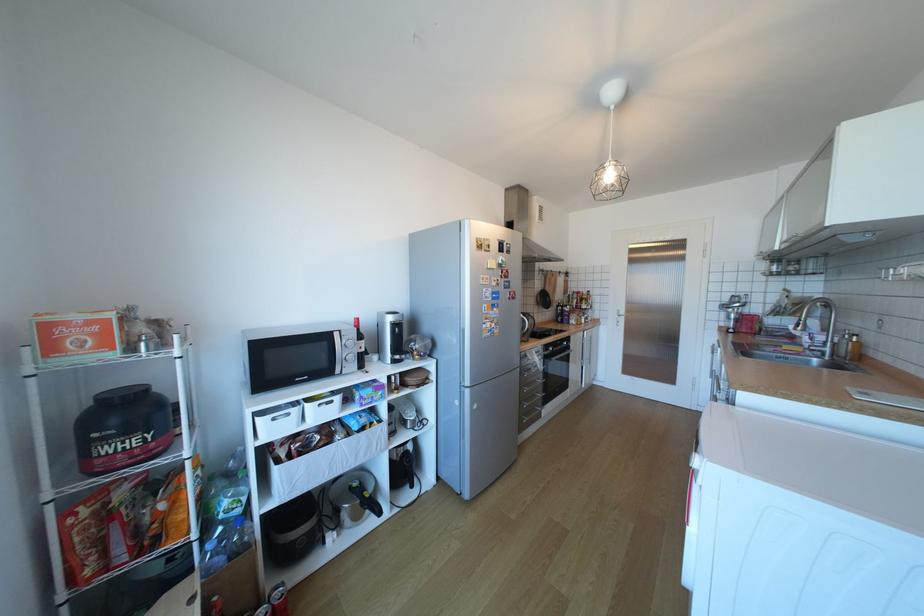
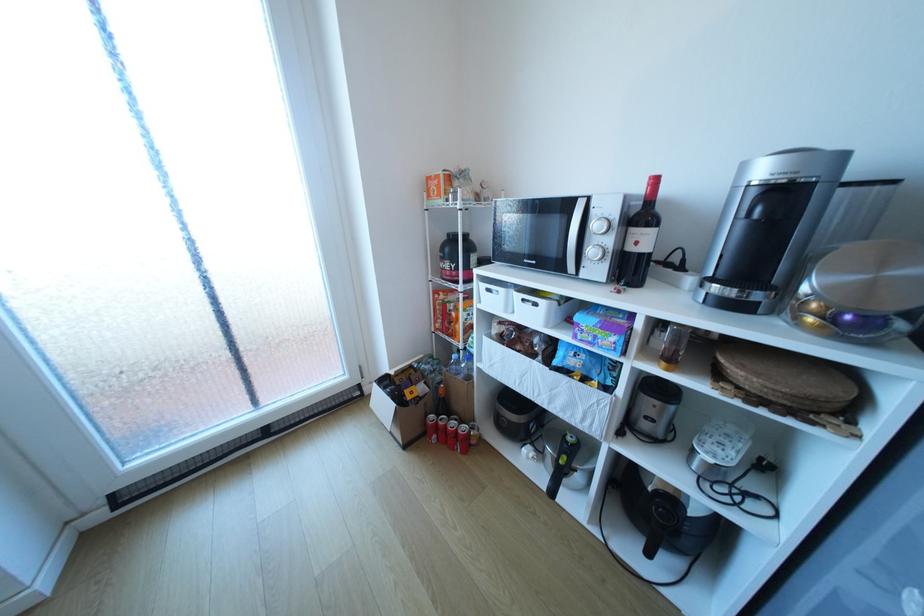
The images are taken continuously from a first-person perspective. In which direction is your viewpoint rotating?

The camera rotated toward left-down.